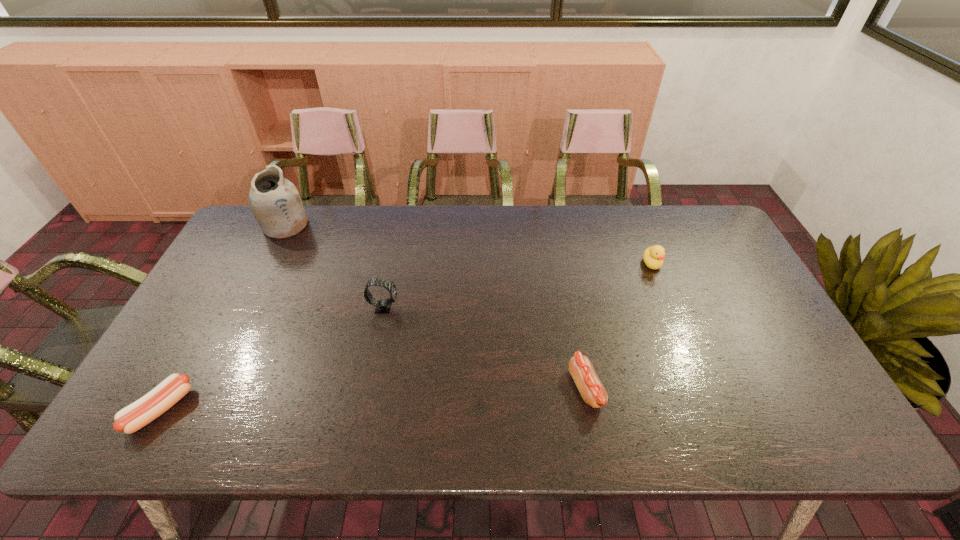
Image resolution: width=960 pixels, height=540 pixels. Identify the location of blank area at the far edge. (408, 219).

Find the location of `free space at the near edge of the desktop`. free space at the near edge of the desktop is located at coordinates (349, 412).

In the image, there is a desktop. Where is `vacant space at the left edge`? Image resolution: width=960 pixels, height=540 pixels. vacant space at the left edge is located at coordinates (176, 337).

You are a GUI agent. You are given a task and a screenshot of the screen. Output one action in this format:
    pyautogui.click(x=<x>, y=<y>)
    Task: Click on the vacant space at the right edge
    
    Given the screenshot: What is the action you would take?
    pyautogui.click(x=739, y=273)

Where is `vacant area that lies between the pottery and the shortest object`? The width and height of the screenshot is (960, 540). vacant area that lies between the pottery and the shortest object is located at coordinates (223, 317).

The image size is (960, 540). Find the location of `unoccupied position between the pottery and the taller sausage`. unoccupied position between the pottery and the taller sausage is located at coordinates (436, 307).

The height and width of the screenshot is (540, 960). Identify the location of free space between the tallest object and the right sausage. (436, 307).

In order to click on free space between the pottery and the second shortest object in this screenshot , I will do `click(436, 307)`.

This screenshot has width=960, height=540. Identify the location of empty space between the third object from right to left and the second farthest object. (517, 286).

At what (x,y) coordinates should I click in order to perform the action: click on empty location between the left sausage and the second farthest object. Please return your answer as a coordinate pair (x, y). Looking at the image, I should click on (406, 336).